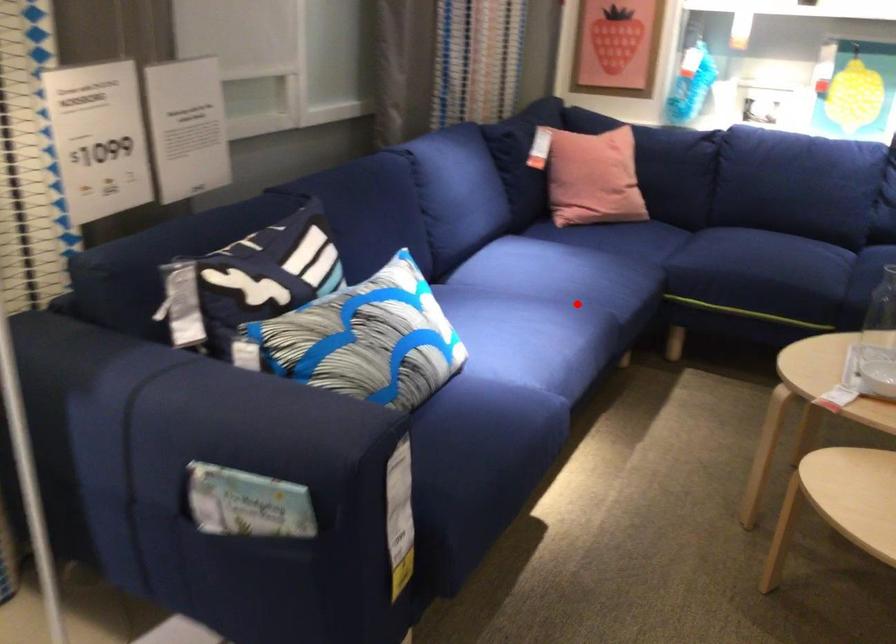
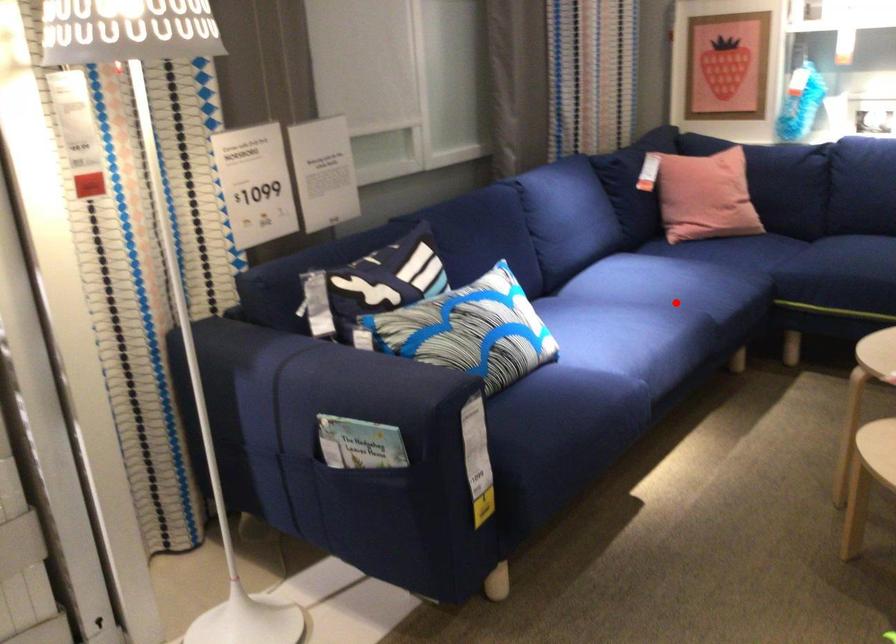
I am providing you with two images of the same scene from different viewpoints. A red point is marked on the first image and another point is marked on the second image. Do the highlighted points in image1 and image2 indicate the same real-world spot?

Yes